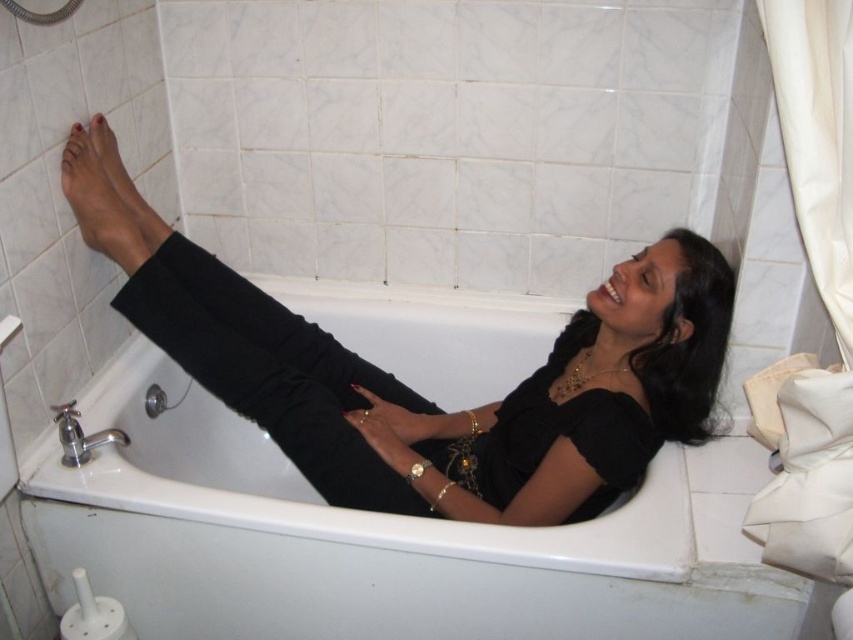
How much distance is there between white glossy bathtub at center and matte black foot at upper left?

20.25 inches

Which of these two, white glossy bathtub at center or matte black foot at upper left, stands taller?

Standing taller between the two is white glossy bathtub at center.

At what (x,y) coordinates should I click in order to perform the action: click on white glossy bathtub at center. Please return your answer as a coordinate pair (x, y). The height and width of the screenshot is (640, 853). Looking at the image, I should click on (315, 536).

In the scene shown: Is black matte pants at center shorter than matte skin foot at upper left?

In fact, black matte pants at center may be taller than matte skin foot at upper left.

Measure the distance between black matte pants at center and camera.

4.26 feet

At what (x,y) coordinates should I click in order to perform the action: click on black matte pants at center. Please return your answer as a coordinate pair (x, y). This screenshot has height=640, width=853. Looking at the image, I should click on (461, 410).

Measure the distance between point (448, 348) and camera.

A distance of 6.22 feet exists between point (448, 348) and camera.

Between white glossy bathtub at center and matte skin foot at upper left, which one has less height?

Standing shorter between the two is matte skin foot at upper left.

Does point (508, 577) come in front of point (128, 204)?

That is True.

Where is `white glossy bathtub at center`? This screenshot has height=640, width=853. white glossy bathtub at center is located at coordinates (315, 536).